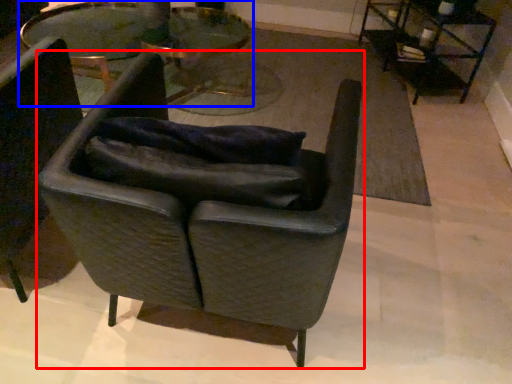
Question: Among these objects, which one is farthest to the camera, chair (highlighted by a red box) or table (highlighted by a blue box)?

Choices:
 (A) chair
 (B) table

Answer: (B)